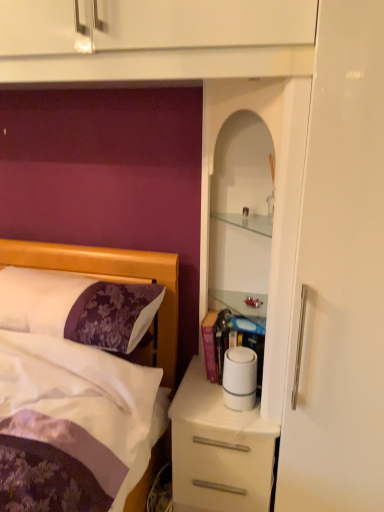
Where is `free space above white glossy desk at center (from a real-world perspective)`? This screenshot has width=384, height=512. free space above white glossy desk at center (from a real-world perspective) is located at coordinates (215, 400).